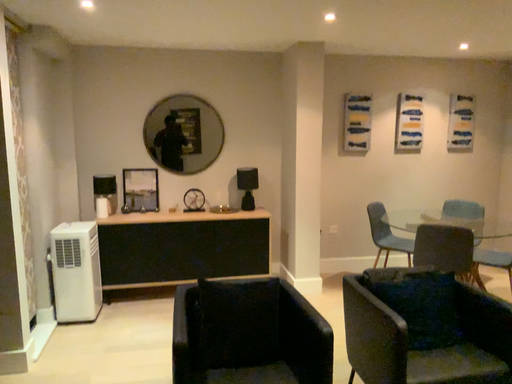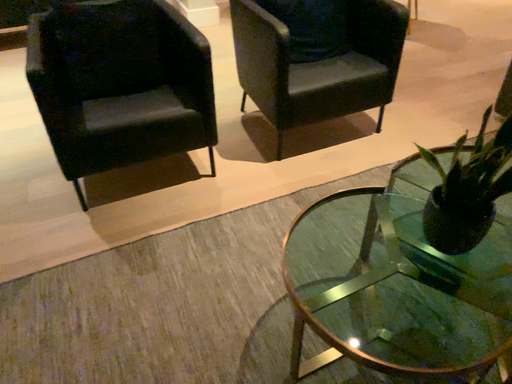
Question: How did the camera likely rotate when shooting the video?

Choices:
 (A) rotated downward
 (B) rotated upward

Answer: (A)